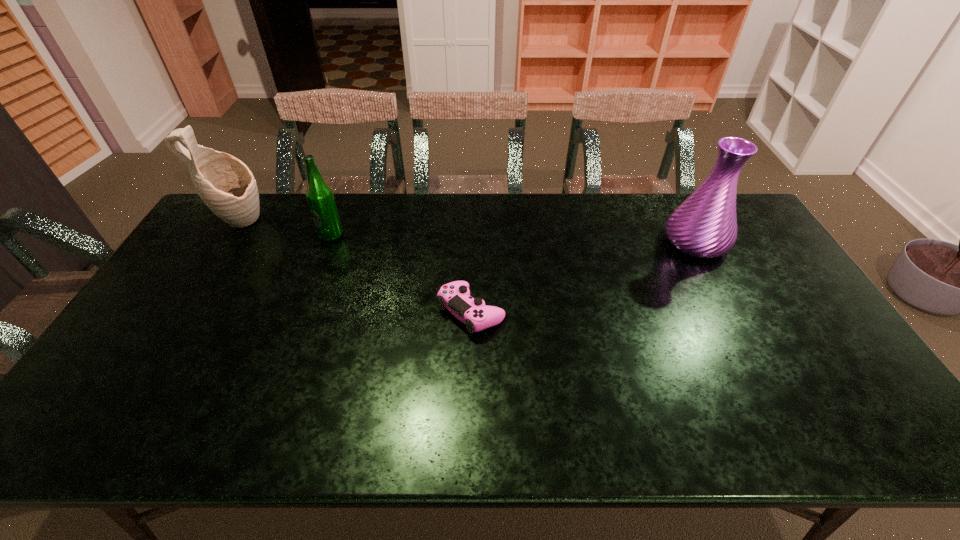
Where is `pitcher at the far edge`? Image resolution: width=960 pixels, height=540 pixels. pitcher at the far edge is located at coordinates (225, 184).

Where is `vase that is at the far edge`? Image resolution: width=960 pixels, height=540 pixels. vase that is at the far edge is located at coordinates (705, 225).

At what (x,y) coordinates should I click in order to perform the action: click on beer bottle present at the far edge. Please return your answer as a coordinate pair (x, y). Looking at the image, I should click on click(319, 196).

Where is `object positioned at the left edge`? The width and height of the screenshot is (960, 540). object positioned at the left edge is located at coordinates click(x=225, y=184).

The height and width of the screenshot is (540, 960). Find the location of `object that is at the right edge`. object that is at the right edge is located at coordinates (705, 225).

Locate an element on the screen. This screenshot has width=960, height=540. object located in the far left corner section of the desktop is located at coordinates (225, 184).

This screenshot has height=540, width=960. What are the coordinates of `object that is at the far right corner` in the screenshot? It's located at (705, 225).

In the image, there is a desktop. At what (x,y) coordinates should I click in order to perform the action: click on vacant region at the far edge. Please return your answer as a coordinate pair (x, y). Looking at the image, I should click on pos(493,208).

At what (x,y) coordinates should I click in order to perform the action: click on free space at the near edge. Please return your answer as a coordinate pair (x, y). Image resolution: width=960 pixels, height=540 pixels. Looking at the image, I should click on (806, 434).

Where is `free space at the left edge`? This screenshot has height=540, width=960. free space at the left edge is located at coordinates (156, 326).